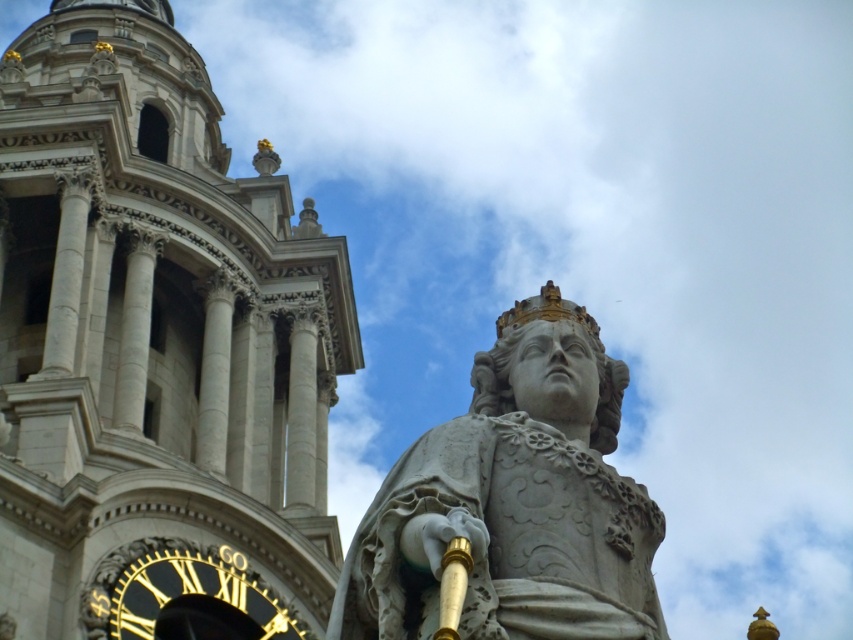
Is white stone tower at upper center above white stone statue at center?

Indeed, white stone tower at upper center is positioned over white stone statue at center.

Does white stone tower at upper center appear under white stone statue at center?

Actually, white stone tower at upper center is above white stone statue at center.

Is point (109, 301) positioned after point (614, 545)?

Yes, point (109, 301) is behind point (614, 545).

You are a GUI agent. You are given a task and a screenshot of the screen. Output one action in this format:
    pyautogui.click(x=<x>, y=<y>)
    Task: Click on the white stone tower at upper center
    
    Given the screenshot: What is the action you would take?
    pyautogui.click(x=155, y=342)

Which is above, white stone tower at upper center or goldmaterial/textureclock at lower left?

Positioned higher is white stone tower at upper center.

Is point (190, 209) positioned before point (285, 634)?

No, it is not.

Who is more forward, (62, 497) or (160, 609)?

Point (62, 497)

Locate an element on the screen. Image resolution: width=853 pixels, height=640 pixels. white stone tower at upper center is located at coordinates (155, 342).

Who is more forward, (x=590, y=333) or (x=254, y=579)?

Point (x=590, y=333) is more forward.

Is point (558, 560) positioned after point (213, 570)?

No, it is not.

The height and width of the screenshot is (640, 853). Identify the location of white stone statue at center. (514, 500).